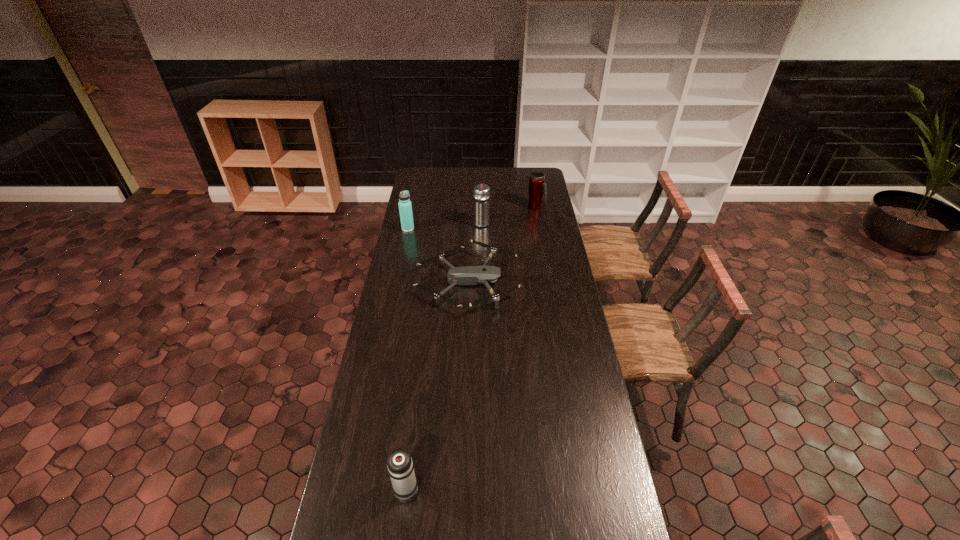
Find the location of a particular element. vacant area that lies between the fourth farthest object and the third thermos bottle from right to left is located at coordinates (437, 383).

At what (x,y) coordinates should I click in order to perform the action: click on vacant space that's between the drone and the leftmost thermos bottle. Please return your answer as a coordinate pair (x, y). The width and height of the screenshot is (960, 540). Looking at the image, I should click on (438, 255).

At what (x,y) coordinates should I click in order to perform the action: click on blank region between the shortest thermos bottle and the third thermos bottle from left to right. Please return your answer as a coordinate pair (x, y). The width and height of the screenshot is (960, 540). Looking at the image, I should click on (444, 354).

Point out which object is positioned as the third nearest to the farthest thermos bottle. Please provide its 2D coordinates. Your answer should be formatted as a tuple, i.e. [(x, y)], where the tuple contains the x and y coordinates of a point satisfying the conditions above.

[(405, 208)]

Identify which object is the closest to the second thermos bottle from right to left. Please provide its 2D coordinates. Your answer should be formatted as a tuple, i.e. [(x, y)], where the tuple contains the x and y coordinates of a point satisfying the conditions above.

[(466, 275)]

Locate which thermos bottle is the closest to the leftmost object. Please provide its 2D coordinates. Your answer should be formatted as a tuple, i.e. [(x, y)], where the tuple contains the x and y coordinates of a point satisfying the conditions above.

[(481, 193)]

Image resolution: width=960 pixels, height=540 pixels. What are the coordinates of `thermos bottle that stands as the third closest to the nearest object` in the screenshot? It's located at (537, 186).